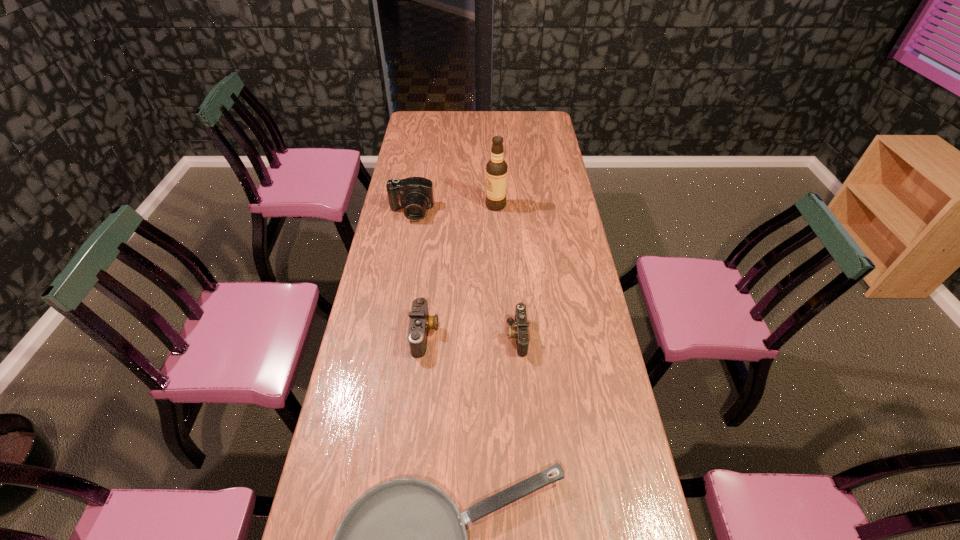
Find the location of a particular element. The height and width of the screenshot is (540, 960). vacant space located 0.110m on the front-facing side of the rightmost camera is located at coordinates (472, 336).

This screenshot has height=540, width=960. I want to click on object located at the left edge, so [x=415, y=194].

Find the location of `vacant space at the far edge of the desktop`. vacant space at the far edge of the desktop is located at coordinates (523, 129).

Identify the location of vacant space at the left edge of the desktop. (382, 460).

What are the coordinates of `vacant space at the right edge of the desktop` in the screenshot? It's located at (568, 231).

Locate an element on the screen. free space between the tallest camera and the alcohol is located at coordinates (453, 209).

Locate an element on the screen. free spot between the alcohol and the tallest camera is located at coordinates (453, 209).

Find the location of `the second closest object relative to the alcohol`. the second closest object relative to the alcohol is located at coordinates (520, 331).

This screenshot has width=960, height=540. I want to click on object that is the fourth closest to the alcohol, so click(x=405, y=539).

The height and width of the screenshot is (540, 960). I want to click on camera object that ranks as the closest to the fourth shortest object, so click(x=420, y=322).